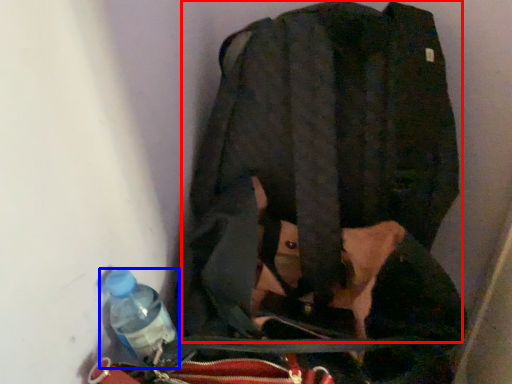
Question: Which object is closer to the camera taking this photo, jacket (highlighted by a red box) or bottle (highlighted by a blue box)?

Choices:
 (A) jacket
 (B) bottle

Answer: (A)